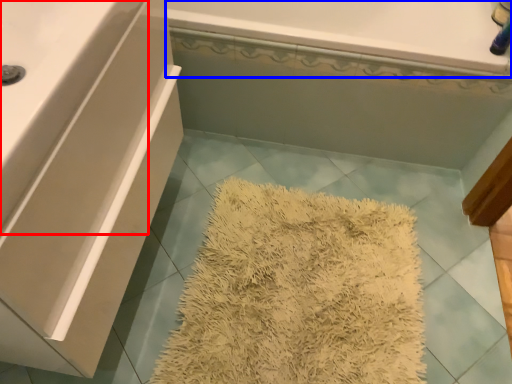
Question: Which object is further to the camera taking this photo, counter top (highlighted by a red box) or bath (highlighted by a blue box)?

Choices:
 (A) counter top
 (B) bath

Answer: (B)